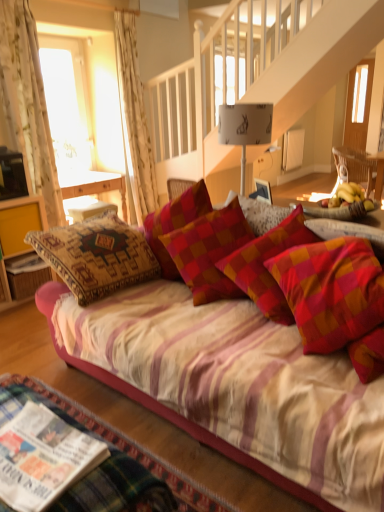
Question: Does yellow wood cabinet at left appear on the right side of plaid fabric pillow at center?

Choices:
 (A) yes
 (B) no

Answer: (B)

Question: Can plaid fabric pillow at center be found inside yellow wood cabinet at left?

Choices:
 (A) yes
 (B) no

Answer: (B)

Question: Does yellow wood cabinet at left have a lesser width compared to plaid fabric pillow at center?

Choices:
 (A) yes
 (B) no

Answer: (B)

Question: Is yellow wood cabinet at left aimed at plaid fabric pillow at center?

Choices:
 (A) yes
 (B) no

Answer: (A)

Question: Considering the relative sizes of yellow wood cabinet at left and plaid fabric pillow at center in the image provided, is yellow wood cabinet at left shorter than plaid fabric pillow at center?

Choices:
 (A) no
 (B) yes

Answer: (A)

Question: From the image's perspective, would you say yellow wood cabinet at left is positioned over plaid fabric pillow at center?

Choices:
 (A) yes
 (B) no

Answer: (B)

Question: Can you confirm if white floral fabric curtain at upper left, the second curtain viewed from the front, is wider than wooden chair at right?

Choices:
 (A) yes
 (B) no

Answer: (B)

Question: Can you confirm if white floral fabric curtain at upper left, the second curtain viewed from the front, is positioned to the left of wooden chair at right?

Choices:
 (A) no
 (B) yes

Answer: (B)

Question: From a real-world perspective, is white floral fabric curtain at upper left, which ranks as the 1th curtain in right-to-left order, physically below wooden chair at right?

Choices:
 (A) no
 (B) yes

Answer: (A)

Question: Could you tell me if white floral fabric curtain at upper left, the second curtain viewed from the left, is turned towards wooden chair at right?

Choices:
 (A) no
 (B) yes

Answer: (A)

Question: Is white floral fabric curtain at upper left, the second curtain viewed from the front, further to the viewer compared to wooden chair at right?

Choices:
 (A) no
 (B) yes

Answer: (A)

Question: Is wooden chair at right at the back of white floral fabric curtain at upper left, the second curtain viewed from the left?

Choices:
 (A) no
 (B) yes

Answer: (A)

Question: Could you tell me if white floral fabric curtain at upper left, which ranks as the 1th curtain in right-to-left order, is facing white glossy magazine at lower left, arranged as the 2th magazine when viewed from the front?

Choices:
 (A) no
 (B) yes

Answer: (A)